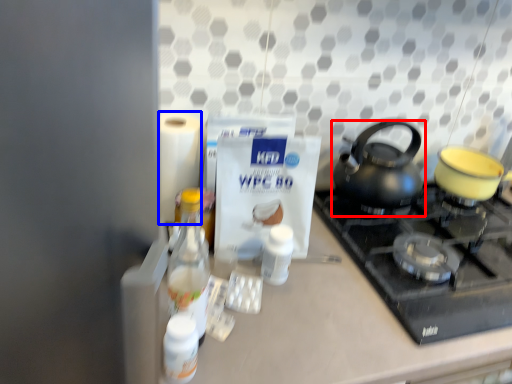
Question: Which object appears closest to the camera in this image, kettle (highlighted by a red box) or toilet paper (highlighted by a blue box)?

Choices:
 (A) kettle
 (B) toilet paper

Answer: (B)